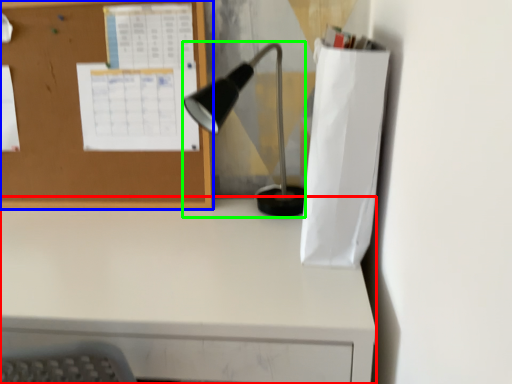
Question: Which object is positioned farthest from desk (highlighted by a red box)? Select from bulletin board (highlighted by a blue box) and lamp (highlighted by a green box).

Choices:
 (A) bulletin board
 (B) lamp

Answer: (B)